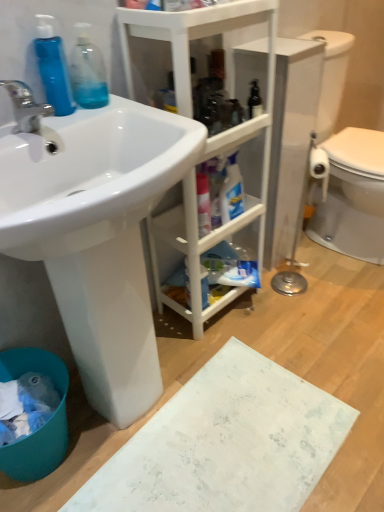
Find the location of a particular element. vacant space to the right of white matte cabinet at center is located at coordinates (292, 314).